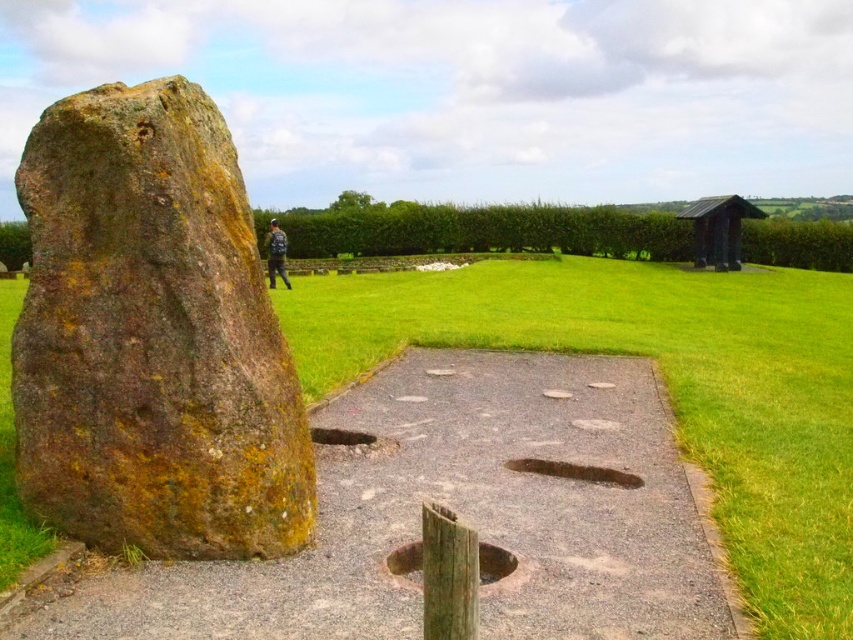
Does gray gravel path at center appear on the left side of brown rough hole at center?

Indeed, gray gravel path at center is positioned on the left side of brown rough hole at center.

This screenshot has width=853, height=640. I want to click on gray gravel path at center, so click(457, 513).

Where is `gray gravel path at center`? The height and width of the screenshot is (640, 853). gray gravel path at center is located at coordinates (457, 513).

Does brown rough stone at center appear over blue fabric jacket at upper center?

Actually, brown rough stone at center is below blue fabric jacket at upper center.

Between brown rough stone at center and blue fabric jacket at upper center, which one has less height?

Standing shorter between the two is brown rough stone at center.

Is point (619, 483) positioned after point (286, 244)?

That is False.

Locate an element on the screen. brown rough stone at center is located at coordinates (575, 472).

Does point (136, 147) come behind point (335, 432)?

No, it is in front of (335, 432).

How far apart are rusty stone boulder at left and brown stone hole at center?

rusty stone boulder at left and brown stone hole at center are 2.43 meters apart.

You are a GUI agent. You are given a task and a screenshot of the screen. Output one action in this format:
    pyautogui.click(x=<x>, y=<y>)
    Task: Click on the rusty stone boulder at left
    The height and width of the screenshot is (640, 853).
    Given the screenshot: What is the action you would take?
    pyautogui.click(x=152, y=337)